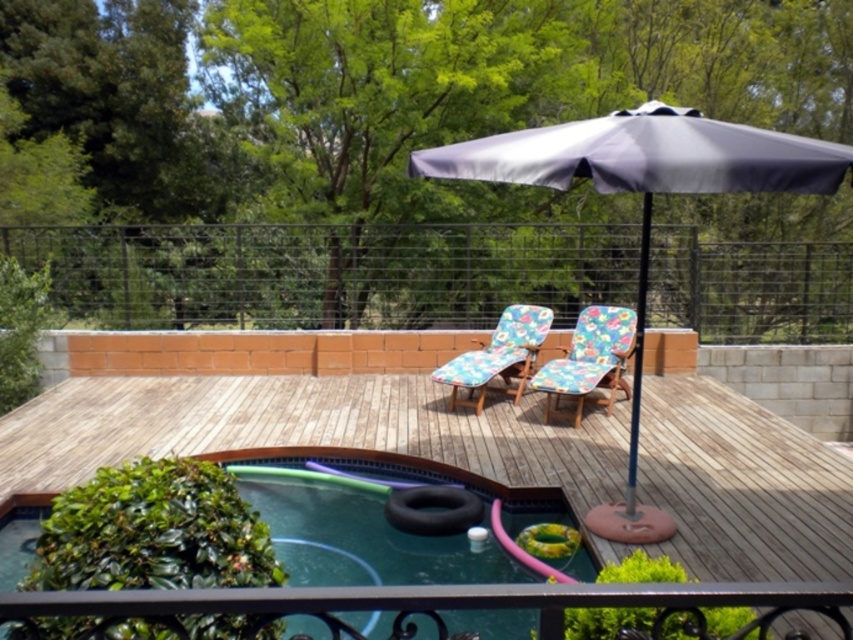
You are standing at the edge of the pool and want to place a small potted plant between the two points marked as point (653, 125) and point (764, 636). Which point should the plant be closer to in order to be nearer to the camera?

The plant should be closer to point (653, 125) because it is further to the camera than point (764, 636).

You are a parent supervising children playing in the pool area. You need to ensure that the smooth green rubber at lower center is within your line of sight while sitting under the gray fabric umbrella at upper center. Is this possible?

Yes, because the smooth green rubber at lower center is located below the gray fabric umbrella at upper center, so it would be visible from under the umbrella.

You are a maintenance worker who needs to check the distance between the smooth green rubber at lower center and the gray fabric umbrella at upper center. Can you confirm if the distance is more than 7 feet?

The smooth green rubber at lower center is 7.29 feet away from the gray fabric umbrella at upper center, so yes, the distance is more than 7 feet.